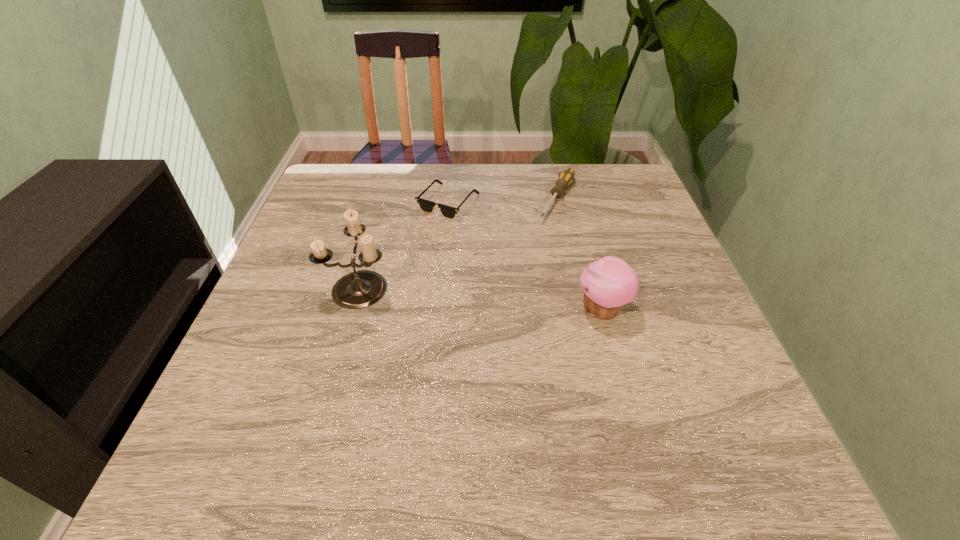
Where is `vacant region at the left edge of the desktop`? vacant region at the left edge of the desktop is located at coordinates (309, 214).

Where is `vacant space at the right edge`? vacant space at the right edge is located at coordinates point(662,316).

In the image, there is a desktop. What are the coordinates of `free space at the far left corner` in the screenshot? It's located at (352, 194).

Image resolution: width=960 pixels, height=540 pixels. I want to click on vacant region at the far right corner of the desktop, so click(x=614, y=169).

You are a GUI agent. You are given a task and a screenshot of the screen. Output one action in this format:
    pyautogui.click(x=<x>, y=<y>)
    Task: Click on the vacant area between the cupcake and the shortest object
    This screenshot has height=540, width=960.
    Given the screenshot: What is the action you would take?
    pyautogui.click(x=525, y=256)

At what (x,y) coordinates should I click in order to perform the action: click on empty space that is in between the third object from right to left and the third shortest object. Please return your answer as a coordinate pair (x, y). The image size is (960, 540). Looking at the image, I should click on (525, 256).

Locate an element on the screen. The image size is (960, 540). free space between the shortest object and the leftmost object is located at coordinates (404, 244).

Image resolution: width=960 pixels, height=540 pixels. What are the coordinates of `free space that is in between the cupcake and the second object from left to right` in the screenshot? It's located at (525, 256).

Identify the location of unoccupied area between the screwdriver and the third object from right to left. This screenshot has height=540, width=960. (503, 201).

Identify the location of vacant space in between the second tallest object and the tallest object. This screenshot has height=540, width=960. (481, 298).